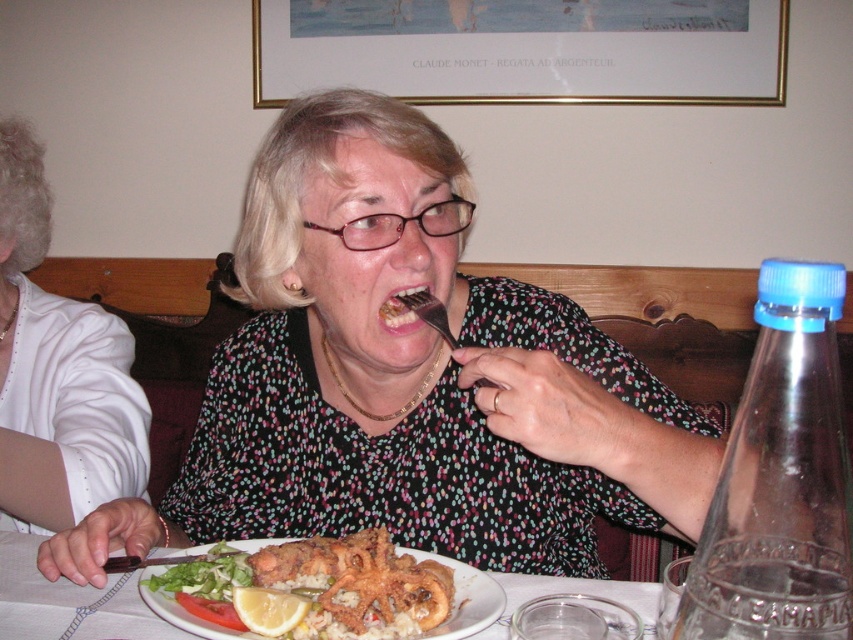
Question: Which object is positioned closest to the white ceramic plate at center?

Choices:
 (A) transparent plastic bottle at right
 (B) matte black dress at center

Answer: (B)

Question: Does transparent plastic bottle at right come in front of white satin blouse at left?

Choices:
 (A) yes
 (B) no

Answer: (A)

Question: Which is farther from the matte black dress at center?

Choices:
 (A) white matte plate at center
 (B) white satin blouse at left
 (C) transparent plastic bottle at right
 (D) white ceramic plate at center

Answer: (B)

Question: Which of these objects is positioned farthest from the yellow matte lemon at plate center?

Choices:
 (A) white matte plate at center
 (B) white ceramic plate at center
 (C) matte black dress at center

Answer: (C)

Question: Can you confirm if matte black dress at center is positioned above white matte plate at center?

Choices:
 (A) yes
 (B) no

Answer: (A)

Question: Can you confirm if matte black dress at center is smaller than white matte plate at center?

Choices:
 (A) no
 (B) yes

Answer: (A)